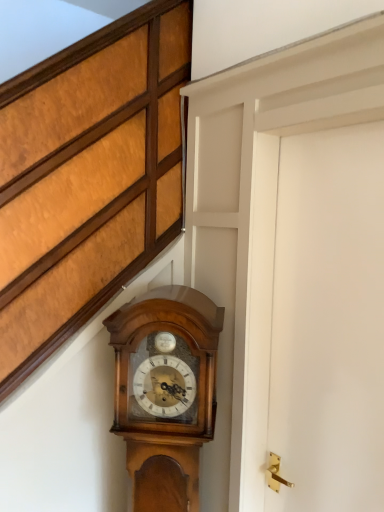
Describe the element at coordinates (316, 320) in the screenshot. I see `white matte door at right` at that location.

At what (x,y) coordinates should I click in order to perform the action: click on white matte door at right. Please return your answer as a coordinate pair (x, y). This screenshot has height=512, width=384. Looking at the image, I should click on (316, 320).

Based on the photo, what is the approximate width of white matte door at right?

3.77 inches.

What do you see at coordinates (165, 391) in the screenshot? The width and height of the screenshot is (384, 512). I see `polished wood wall clock at center` at bounding box center [165, 391].

Find the location of a particular element. polished wood wall clock at center is located at coordinates (165, 391).

I want to click on white matte door at right, so click(x=316, y=320).

Considering the relative positions of white matte door at right and polished wood wall clock at center in the image provided, is white matte door at right to the left of polished wood wall clock at center from the viewer's perspective?

No, white matte door at right is not to the left of polished wood wall clock at center.

Who is more distant, white matte door at right or polished wood wall clock at center?

polished wood wall clock at center is further from the camera.

Which point is more distant from viewer, (364, 262) or (155, 442)?

The point (155, 442) is farther from the camera.

From the image's perspective, is white matte door at right located above polished wood wall clock at center?

Correct, white matte door at right appears higher than polished wood wall clock at center in the image.

Consider the image. From a real-world perspective, relative to polished wood wall clock at center, is white matte door at right vertically above or below?

white matte door at right is situated higher than polished wood wall clock at center in the real world.

Considering the relative sizes of white matte door at right and polished wood wall clock at center in the image provided, is white matte door at right thinner than polished wood wall clock at center?

Yes, white matte door at right is thinner than polished wood wall clock at center.

Considering the relative sizes of white matte door at right and polished wood wall clock at center in the image provided, is white matte door at right taller than polished wood wall clock at center?

Yes.

Based on their sizes in the image, would you say white matte door at right is bigger or smaller than polished wood wall clock at center?

Clearly, white matte door at right is smaller in size than polished wood wall clock at center.

Is white matte door at right surrounding polished wood wall clock at center?

No, polished wood wall clock at center is not surrounded by white matte door at right.

Is white matte door at right directly adjacent to polished wood wall clock at center?

There is a gap between white matte door at right and polished wood wall clock at center.

Consider the image. Is white matte door at right positioned with its back to polished wood wall clock at center?

No, white matte door at right is not facing away from polished wood wall clock at center.

Find the location of a particular element. The image size is (384, 512). door located on the right of polished wood wall clock at center is located at coordinates (316, 320).

Which is more to the left, polished wood wall clock at center or white matte door at right?

polished wood wall clock at center.

Which is in front, polished wood wall clock at center or white matte door at right?

white matte door at right is closer to the camera.

Which point is more forward, (183, 358) or (372, 344)?

The point (372, 344) is more forward.

From the image's perspective, between polished wood wall clock at center and white matte door at right, who is located below?

polished wood wall clock at center is shown below in the image.

From a real-world perspective, which object stands above the other?

In real-world perspective, white matte door at right is above.

Considering the sizes of objects polished wood wall clock at center and white matte door at right in the image provided, who is thinner, polished wood wall clock at center or white matte door at right?

Thinner between the two is white matte door at right.

Which of these two, polished wood wall clock at center or white matte door at right, stands shorter?

With less height is polished wood wall clock at center.

Who is bigger, polished wood wall clock at center or white matte door at right?

polished wood wall clock at center is bigger.

Which is correct: polished wood wall clock at center is inside white matte door at right, or outside of it?

polished wood wall clock at center is located beyond the bounds of white matte door at right.

Is polished wood wall clock at center placed right next to white matte door at right?

No.

Is polished wood wall clock at center looking in the opposite direction of white matte door at right?

polished wood wall clock at center is not turned away from white matte door at right.

What's the angular difference between polished wood wall clock at center and white matte door at right's facing directions?

The angle between the facing direction of polished wood wall clock at center and the facing direction of white matte door at right is 44.8 degrees.

In order to click on wall clock that is on the left side of white matte door at right in this screenshot , I will do tap(165, 391).

Identify the location of door above the polished wood wall clock at center (from the image's perspective). (316, 320).

You are a GUI agent. You are given a task and a screenshot of the screen. Output one action in this format:
    pyautogui.click(x=<x>, y=<y>)
    Task: Click on the wall clock below the white matte door at right (from a real-world perspective)
    The image size is (384, 512).
    Given the screenshot: What is the action you would take?
    pyautogui.click(x=165, y=391)